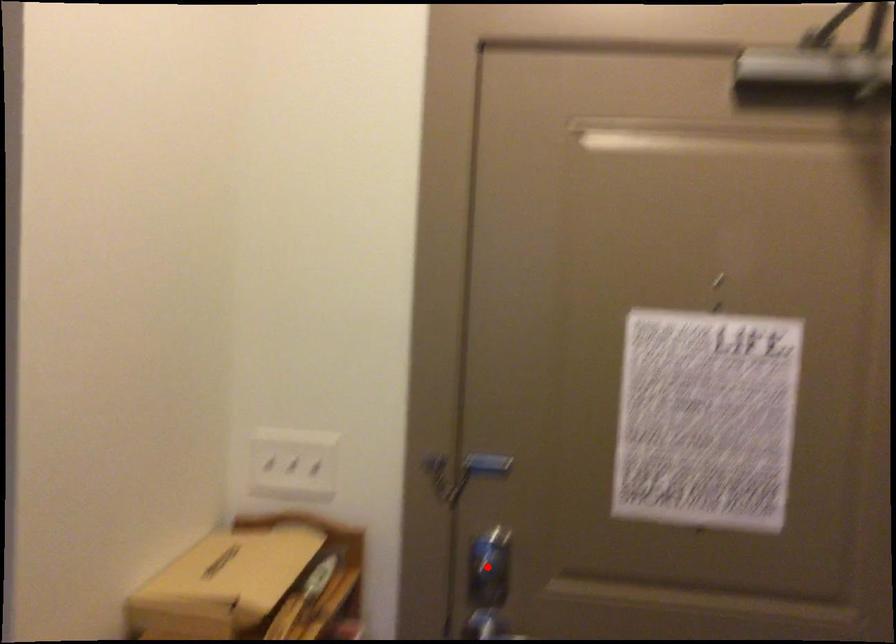
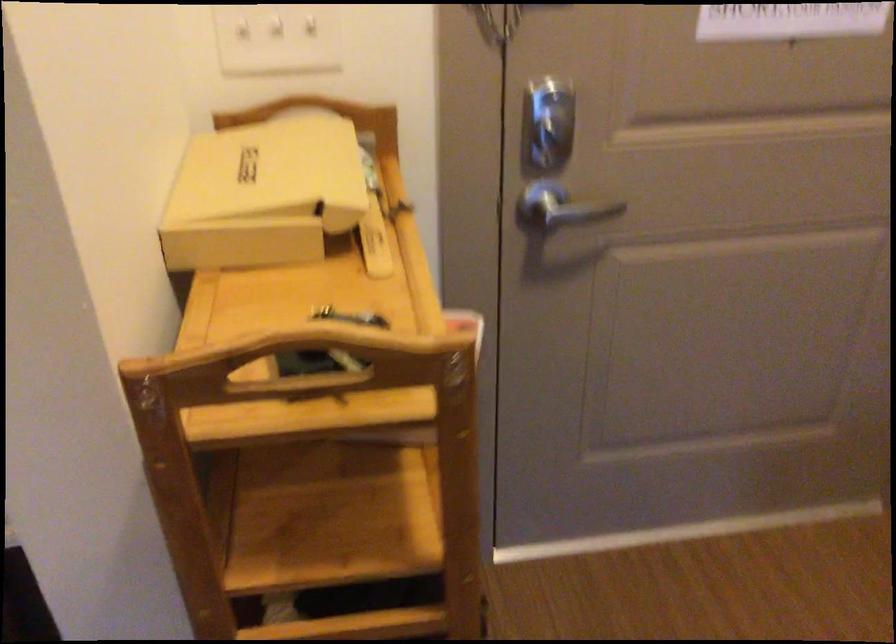
Question: I am providing you with two images of the same scene from different viewpoints. Image1 has a red point marked. In image2, the corresponding 3D location appears at what relative position? Reply with the corresponding letter.

Choices:
 (A) Closer
 (B) Farther

Answer: (A)